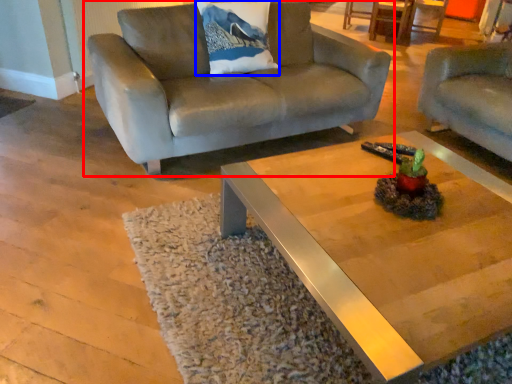
Question: Which point is closer to the camera, studio couch (highlighted by a red box) or pillow (highlighted by a blue box)?

Choices:
 (A) studio couch
 (B) pillow

Answer: (A)